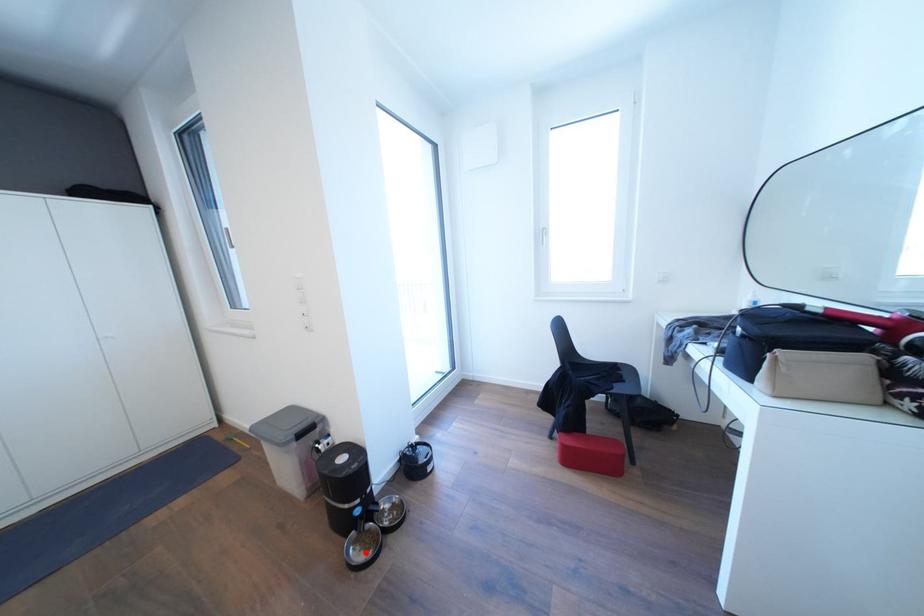
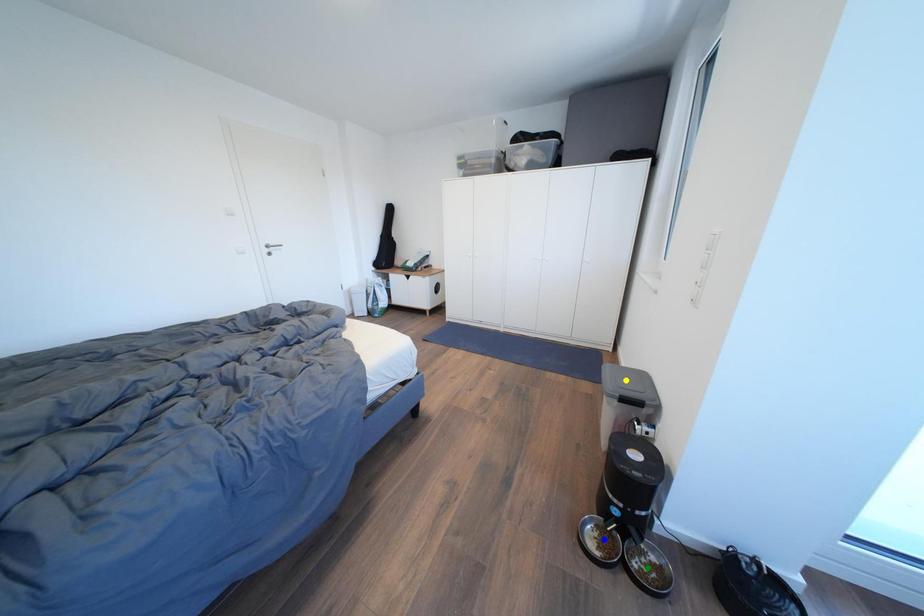
Question: I am providing you with two images of the same scene from different viewpoints. A red point is marked on the first image. You are given multiple points on the second image. Which spot in image 2 lines up with the point in image 1?

Choices:
 (A) blue point
 (B) yellow point
 (C) green point

Answer: (A)